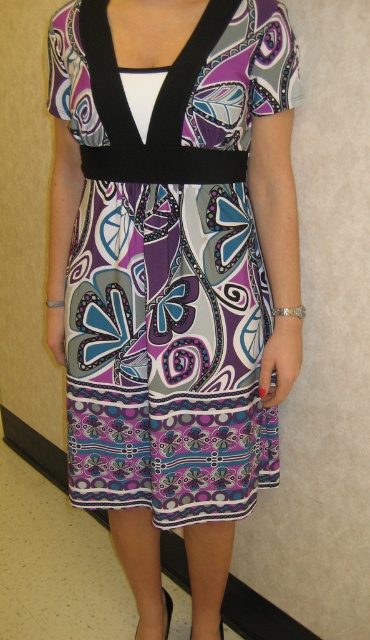
Question: Which point appears farthest from the camera in this image?

Choices:
 (A) (166, 630)
 (B) (165, 218)

Answer: (A)

Question: Considering the real-world distances, which object is closest to the black leather sandal at lower center?

Choices:
 (A) purple printed dress at center
 (B) matte black sandal at lower center

Answer: (B)

Question: Which point is farther to the camera?

Choices:
 (A) purple printed dress at center
 (B) matte black sandal at lower center

Answer: (B)

Question: Is the position of matte black sandal at lower center less distant than that of black leather sandal at lower center?

Choices:
 (A) yes
 (B) no

Answer: (B)

Question: Does matte black sandal at lower center have a smaller size compared to black leather sandal at lower center?

Choices:
 (A) no
 (B) yes

Answer: (B)

Question: Does purple printed dress at center appear under black leather sandal at lower center?

Choices:
 (A) no
 (B) yes

Answer: (A)